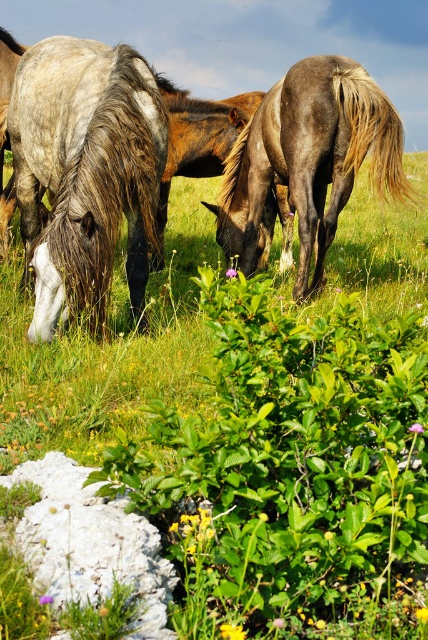
You are a farmer checking the size of your horses. You have a stable door that can only accommodate animals narrower than the dark brown glossy horse at center. Will the white matte horse at left fit through the door?

The white matte horse at left is narrower than the dark brown glossy horse at center, so it should fit through the stable door designed for animals narrower than the dark brown glossy horse at center.

You are standing in the field and want to approach the white glossy horse at center. Which direction should you move relative to the other horses?

The white glossy horse at center is located at point 0.224 on the y axis, so you should move towards the center area where it is positioned between the other horses.